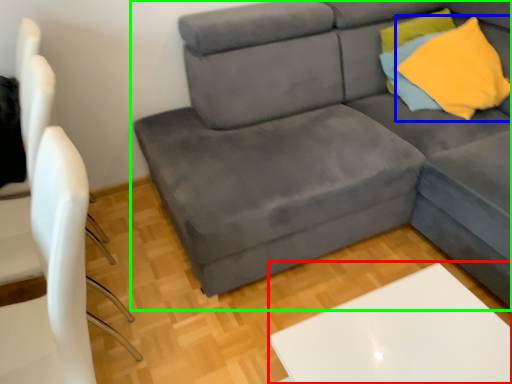
Question: Which object is positioned farthest from table (highlighted by a red box)? Select from throw pillow (highlighted by a blue box) and studio couch (highlighted by a green box).

Choices:
 (A) throw pillow
 (B) studio couch

Answer: (A)